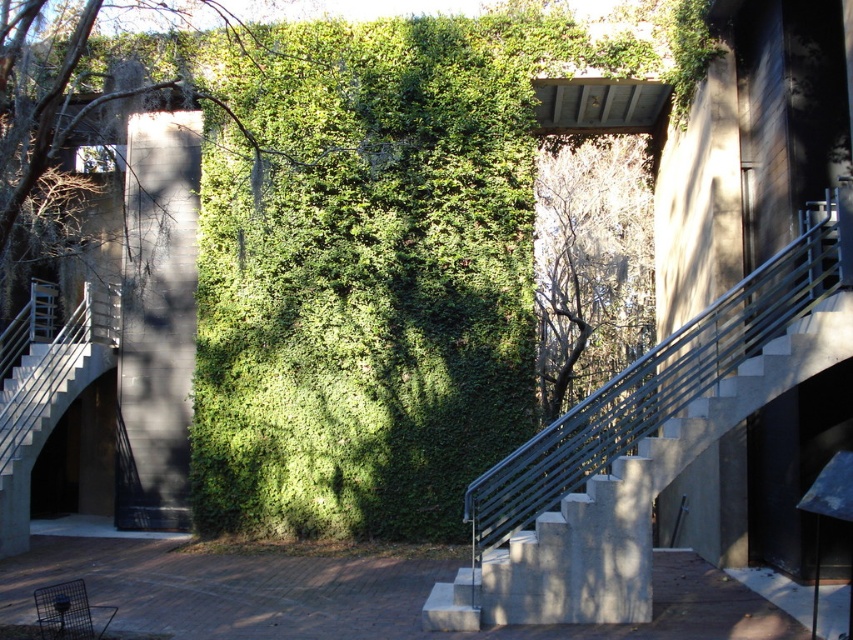
In the scene shown: You are standing at the base of the concrete stairs at center and want to reach the green leafy wall at upper center. Is the wall visible from your current position?

The green leafy wall at upper center is behind the concrete stairs at center, so it is not visible from the base of the stairs.

You are a delivery person with a cart that is 1.5 meters wide. You need to navigate between the concrete stairs at center and the green leafy tree at center to reach the delivery point behind them. Can your cart fit through the space between them?

The concrete stairs at center and green leafy tree at center are 11.40 meters apart, so the cart which is 1.5 meters wide can easily fit through the space between them since the distance is much wider than the cart.

You are standing in front of the modern architectural structure described. You want to walk up the concrete stairs at center, but there is a green leafy tree at center in your way. Can you walk around the tree to reach the stairs?

The concrete stairs at center is closer to the viewer than the green leafy tree at center, so you can walk around the tree to reach the stairs since the stairs are in front of the tree.